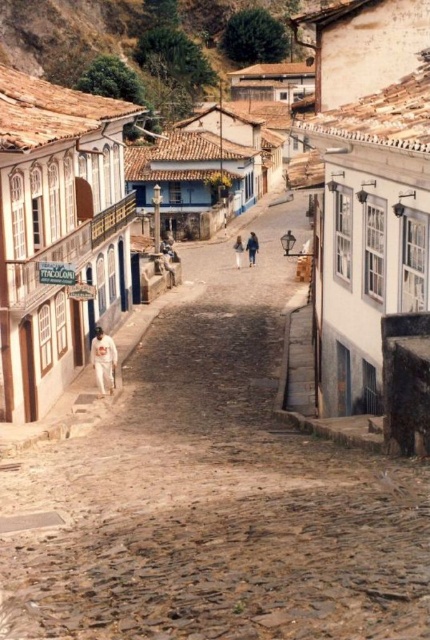
You are a tourist walking along the historic street and notice two pairs of jeans displayed in store windows. The first is blue denim jeans at center, and the second is light blue jeans at center. Which pair of jeans is closer to you as you walk down the street?

The blue denim jeans at center is closer to you because the light blue jeans at center is behind it.

You are a tourist in this historic town and want to find the blue denim jeans at center. According to the map, you are currently standing at point (251,248). Can you see the blue denim jeans at center from your current position?

Yes, you are currently standing at the exact location of the blue denim jeans at center, so you can see it directly around you.